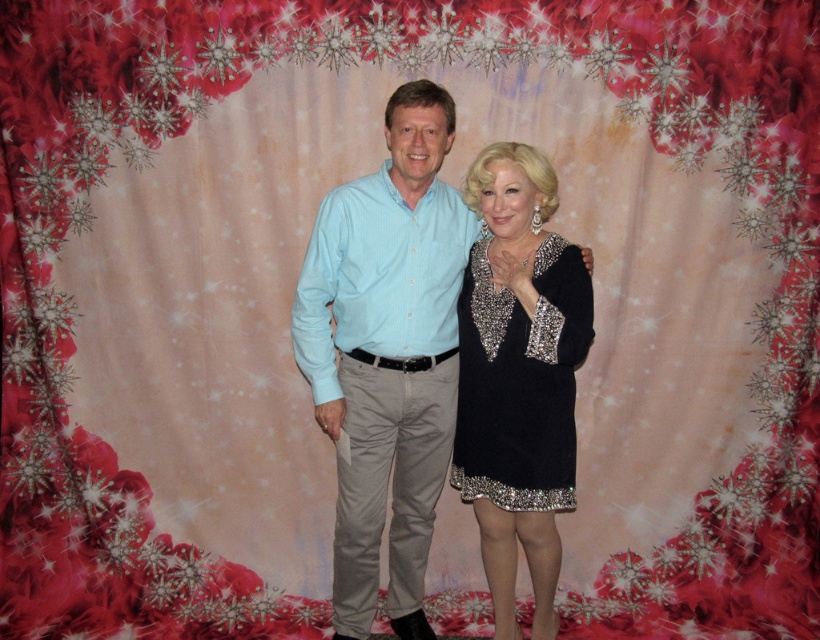
You are taking a photo of two people standing against a festive backdrop. You want to place a decorative ribbon between the two points mentioned in the scene. Which point is closer to the camera, point (377, 317) or point (550, 262)?

Point (377, 317) is further to the viewer than point (550, 262), so the point closer to the camera is point (550, 262).

You are organizing a charity event and need to decide which outfit takes more space in the wardrobe. Which of the two outfits, the light blue shirt at center or the black sequined dress at center, requires more storage space?

The light blue shirt at center is larger in size than the black sequined dress at center, so it requires more storage space.

You are at a holiday party and see two people in the center of the image. One is wearing a light blue shirt at center and the other a black sequined dress at center. From the perspective of someone facing them, which clothing item is positioned to the left?

The light blue shirt at center is to the left of the black sequined dress at center.